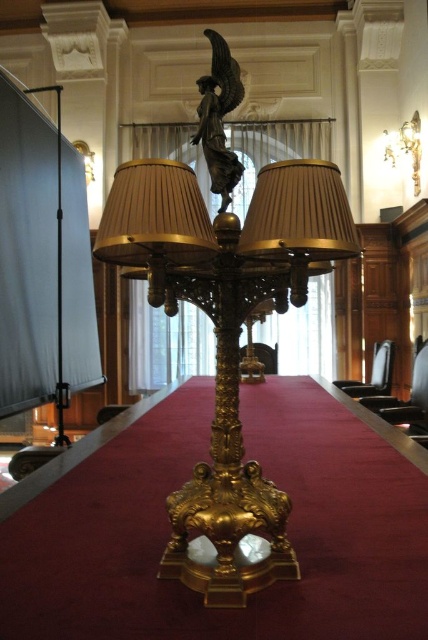
You are an interior designer planning to place a new sculpture that is 2 meters wide between the bronze statue at center and the gold metallic lampshade at upper right. Will there be enough space between them to accommodate the sculpture without moving either object?

The bronze statue at center and gold metallic lampshade at upper right are 4.75 meters apart from each other. Since the sculpture is 2 meters wide, there is sufficient space between them to place it without moving either object.

You are an interior designer arranging a formal event. You need to place a new decorative item between the bronze statue at center and the gold metallic lampshade at upper right. Based on their current positions, where should you place the new item to ensure it is between them?

The bronze statue at center is positioned under the gold metallic lampshade at upper right, so placing the new item between them would require positioning it above the bronze statue at center but below the gold metallic lampshade at upper right.